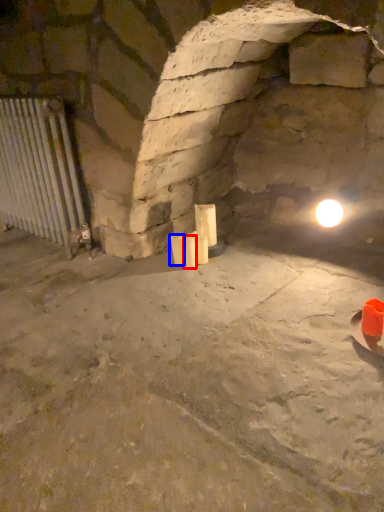
Question: Among these objects, which one is farthest to the camera, candle (highlighted by a red box) or candle (highlighted by a blue box)?

Choices:
 (A) candle
 (B) candle

Answer: (B)